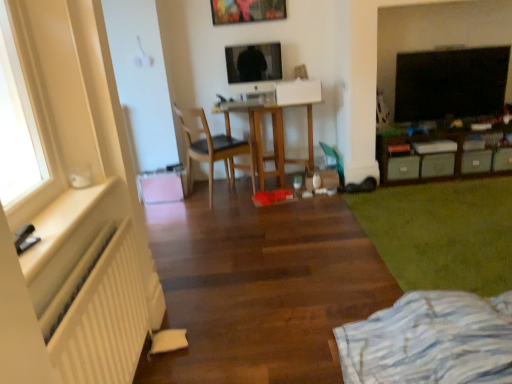
I want to click on vacant area in front of green matte drawer at right, which appears as the 2th drawer when viewed from the right, so click(x=486, y=180).